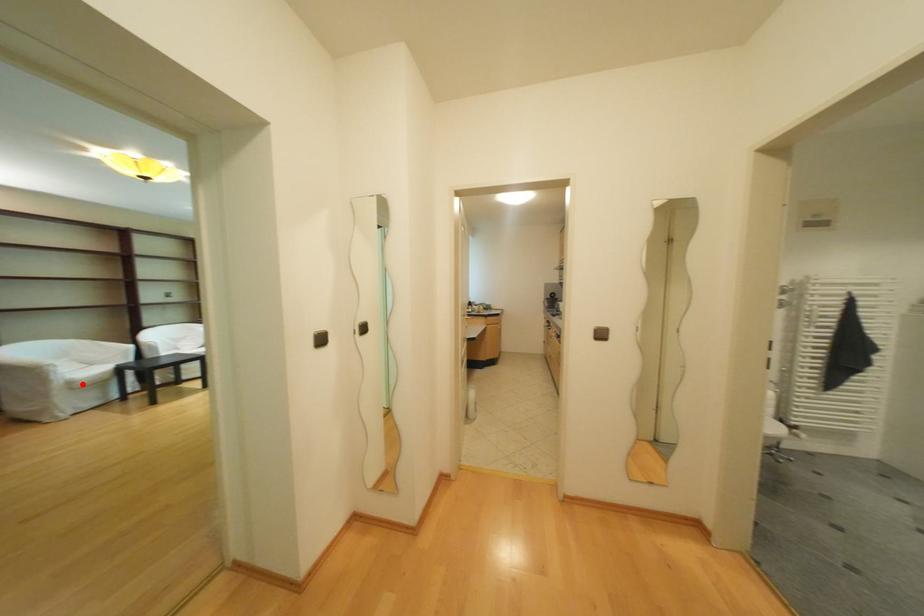
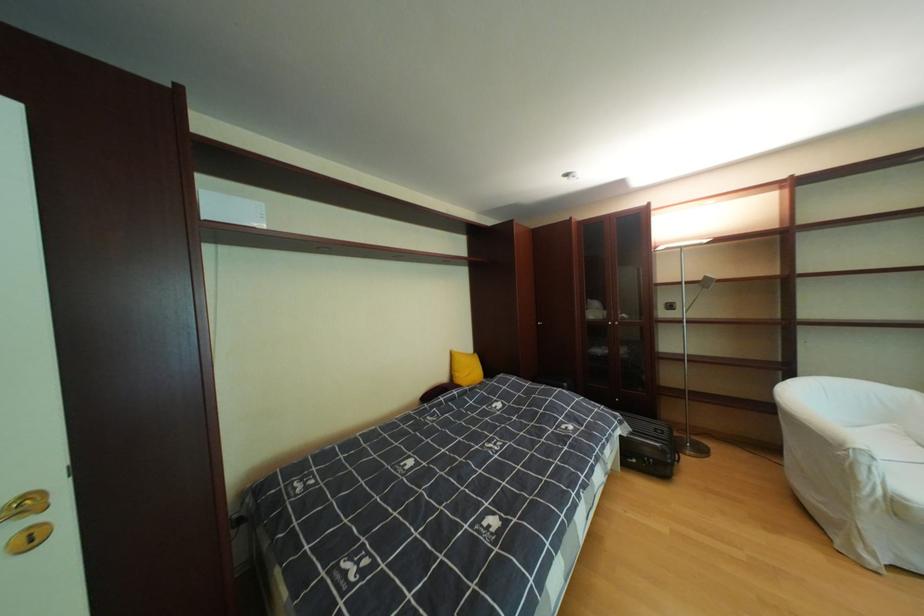
In the second image, find the point that corresponds to the highlighted location in the first image.

(908, 506)